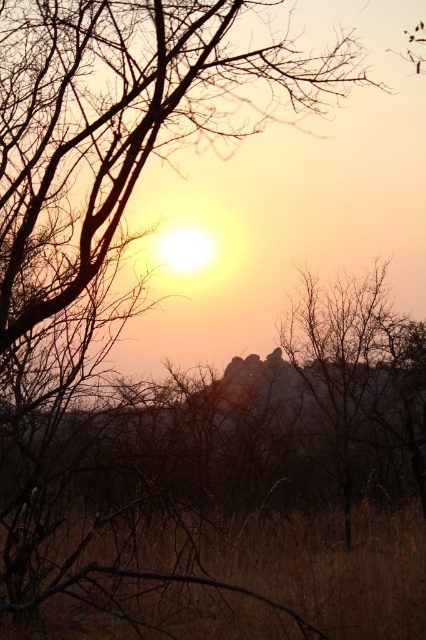
Question: Can you confirm if brown dry grass at lower center is wider than brown textured tree at center?

Choices:
 (A) no
 (B) yes

Answer: (B)

Question: Which point is closer to the camera?

Choices:
 (A) (399, 422)
 (B) (333, 570)

Answer: (B)

Question: Does brown dry grass at lower center appear under brown textured tree at center?

Choices:
 (A) no
 (B) yes

Answer: (B)

Question: Does brown dry grass at lower center appear on the right side of brown textured tree at center?

Choices:
 (A) no
 (B) yes

Answer: (A)

Question: Which of the following is the closest to the observer?

Choices:
 (A) brown dry grass at lower center
 (B) brown textured tree at center

Answer: (A)